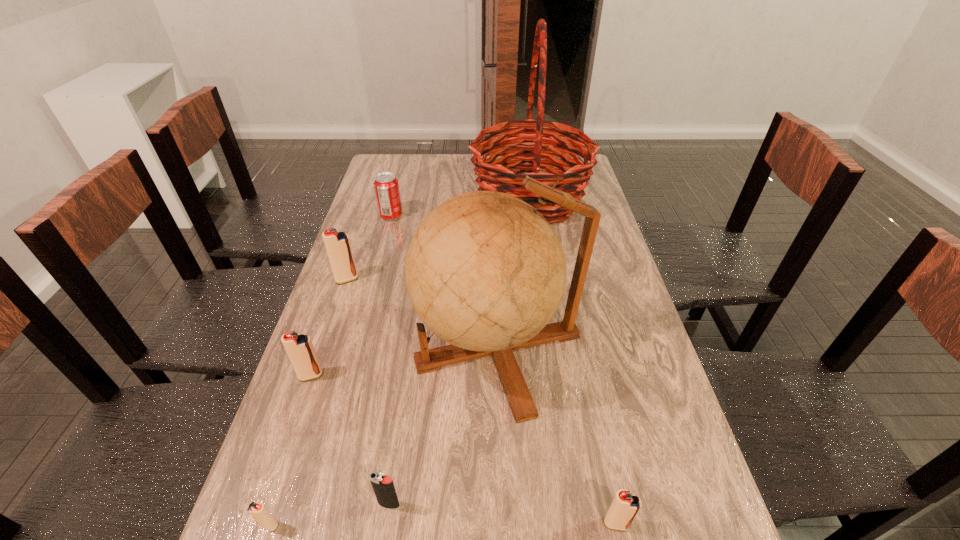
In the image, there is a desktop. Where is `vacant space at the right edge`? Image resolution: width=960 pixels, height=540 pixels. vacant space at the right edge is located at coordinates (607, 264).

Where is `free space between the shortest object and the third smallest red igniter`? This screenshot has height=540, width=960. free space between the shortest object and the third smallest red igniter is located at coordinates pyautogui.click(x=290, y=450).

At what (x,y) coordinates should I click in order to perform the action: click on free space between the second tallest object and the second farthest igniter. Please return your answer as a coordinate pair (x, y). The width and height of the screenshot is (960, 540). Looking at the image, I should click on (405, 362).

Image resolution: width=960 pixels, height=540 pixels. I want to click on vacant region between the third nearest object and the shortest igniter, so click(329, 515).

Identify the location of empty space that is in between the biggest red igniter and the shortest igniter. (308, 402).

Identify the location of free space between the second smallest red igniter and the biggest red igniter. This screenshot has height=540, width=960. (482, 402).

You are a GUI agent. You are given a task and a screenshot of the screen. Output one action in this format:
    pyautogui.click(x=<x>, y=<y>)
    Task: Click on the free space between the third smallest red igniter and the soda
    
    Given the screenshot: What is the action you would take?
    pyautogui.click(x=351, y=296)

Locate an element on the screen. The width and height of the screenshot is (960, 540). free space between the shortest igniter and the second farthest red igniter is located at coordinates (290, 450).

Identify the location of free space that is in between the tallest object and the smallest red igniter. (399, 362).

Identify the location of object identified as the fourth closest to the second tallest object. (299, 348).